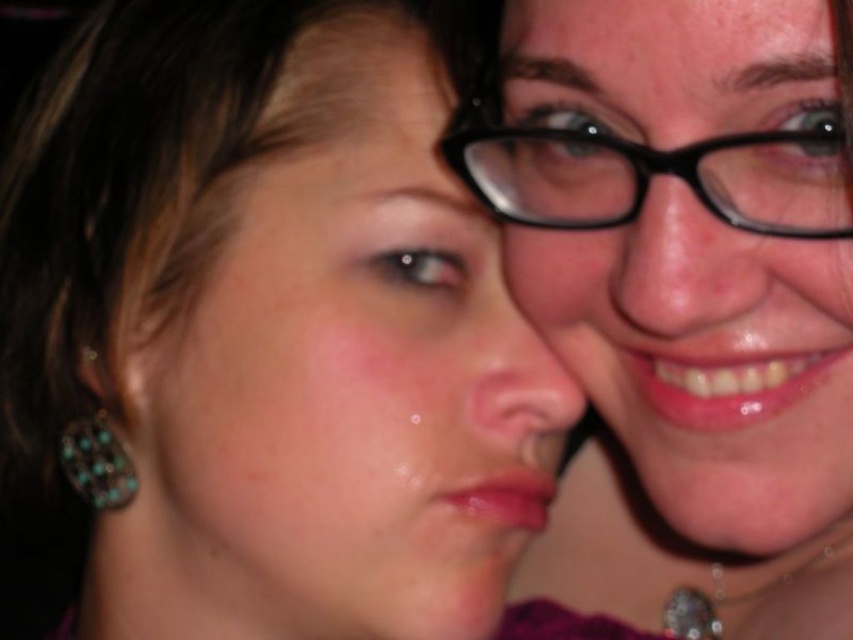
Question: Among these objects, which one is nearest to the camera?

Choices:
 (A) matte black glasses at upper center
 (B) turquoise gemstone earrings at lower left

Answer: (A)

Question: Does matte black glasses at upper center have a smaller size compared to turquoise gemstone earrings at lower left?

Choices:
 (A) no
 (B) yes

Answer: (A)

Question: Which object is closer to the camera taking this photo?

Choices:
 (A) matte black hair at upper left
 (B) matte black glasses at upper center
 (C) turquoise gemstone earrings at lower left
 (D) black plastic glasses at upper center

Answer: (B)

Question: Does matte black hair at upper left appear on the left side of black plastic glasses at upper center?

Choices:
 (A) yes
 (B) no

Answer: (A)

Question: Can you confirm if matte black glasses at upper center is thinner than black plastic glasses at upper center?

Choices:
 (A) yes
 (B) no

Answer: (B)

Question: Which of these objects is positioned closest to the matte black glasses at upper center?

Choices:
 (A) turquoise gemstone earrings at lower left
 (B) black plastic glasses at upper center

Answer: (B)